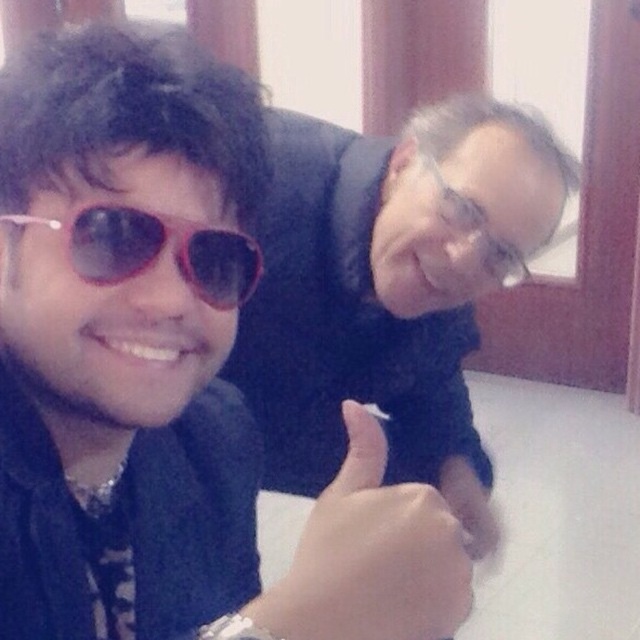
Question: Observing the image, what is the correct spatial positioning of matte black jacket at upper center in reference to pink plastic sunglasses at left?

Choices:
 (A) below
 (B) above

Answer: (A)

Question: Is matte black jacket at upper center to the left of matte black glasses at upper center from the viewer's perspective?

Choices:
 (A) yes
 (B) no

Answer: (A)

Question: Estimate the real-world distances between objects in this image. Which object is closer to the pink plastic sunglasses at left?

Choices:
 (A) matte black thumb at lower center
 (B) matte black glasses at upper center

Answer: (A)

Question: Which of the following is the closest to the observer?

Choices:
 (A) (332, 602)
 (B) (452, 202)

Answer: (A)

Question: Is pink plastic sunglasses at left thinner than matte black glasses at upper center?

Choices:
 (A) no
 (B) yes

Answer: (A)

Question: Which of these objects is positioned farthest from the matte black jacket at upper center?

Choices:
 (A) pink plastic sunglasses at left
 (B) matte black thumb at lower center
 (C) matte black glasses at upper center

Answer: (C)